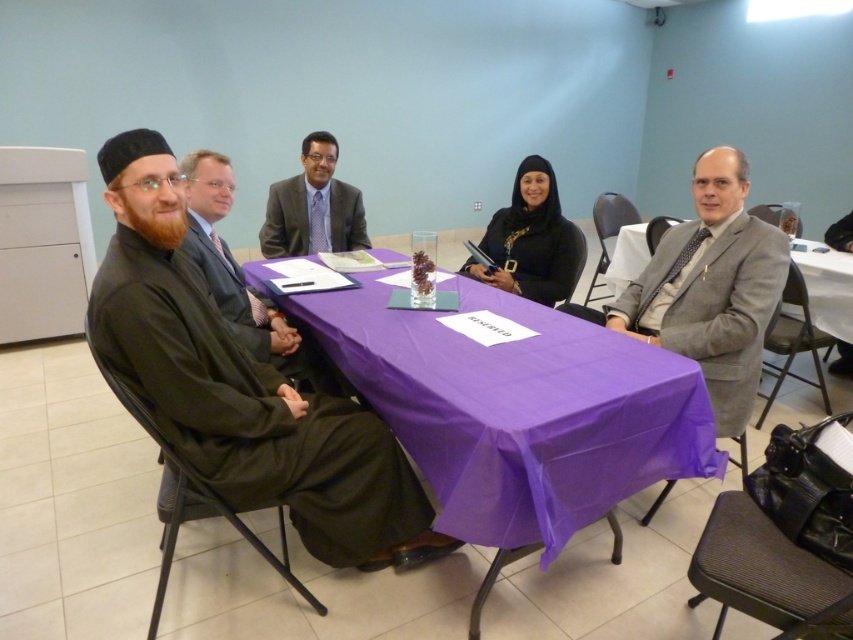
Who is taller, matte black robe at left or black satin robe at center?

matte black robe at left

Looking at this image, who is positioned more to the left, matte black robe at left or black satin robe at center?

matte black robe at left

Between point (215, 256) and point (552, 234), which one is positioned behind?

Positioned behind is point (552, 234).

At what (x,y) coordinates should I click in order to perform the action: click on matte black robe at left. Please return your answer as a coordinate pair (x, y). The width and height of the screenshot is (853, 640). Looking at the image, I should click on (247, 284).

Between point (550, 262) and point (303, 221), which one is positioned in front?

Positioned in front is point (550, 262).

Is black satin robe at center taller than matte black robe at center?

Yes.

The width and height of the screenshot is (853, 640). What do you see at coordinates (529, 240) in the screenshot? I see `black satin robe at center` at bounding box center [529, 240].

Identify the location of black satin robe at center. The width and height of the screenshot is (853, 640). (529, 240).

Is dark olive-green fabric at left taller than matte black robe at center?

Indeed, dark olive-green fabric at left has a greater height compared to matte black robe at center.

Does dark olive-green fabric at left appear under matte black robe at center?

Yes.

Is point (170, 339) more distant than point (292, 212)?

No, it is in front of (292, 212).

The height and width of the screenshot is (640, 853). I want to click on dark olive-green fabric at left, so click(253, 416).